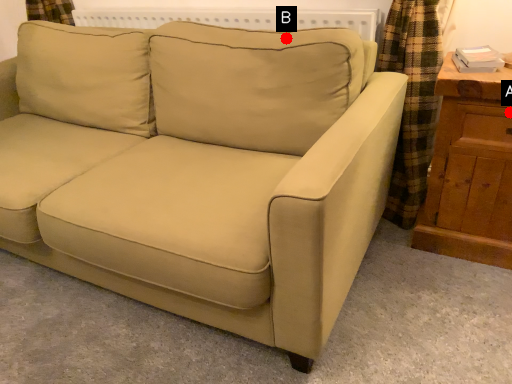
Question: Two points are circled on the image, labeled by A and B beside each circle. Which point is further to the camera?

Choices:
 (A) A is further
 (B) B is further

Answer: (B)